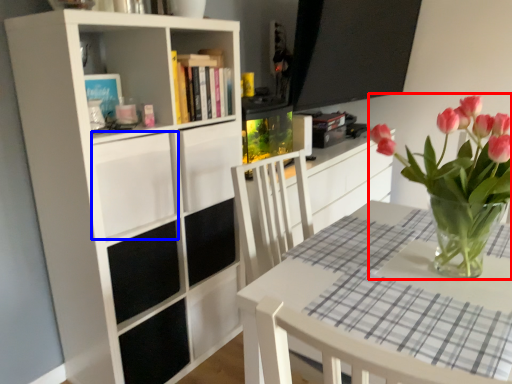
Question: Which object is closer to the camera taking this photo, houseplant (highlighted by a red box) or drawer (highlighted by a blue box)?

Choices:
 (A) houseplant
 (B) drawer

Answer: (A)